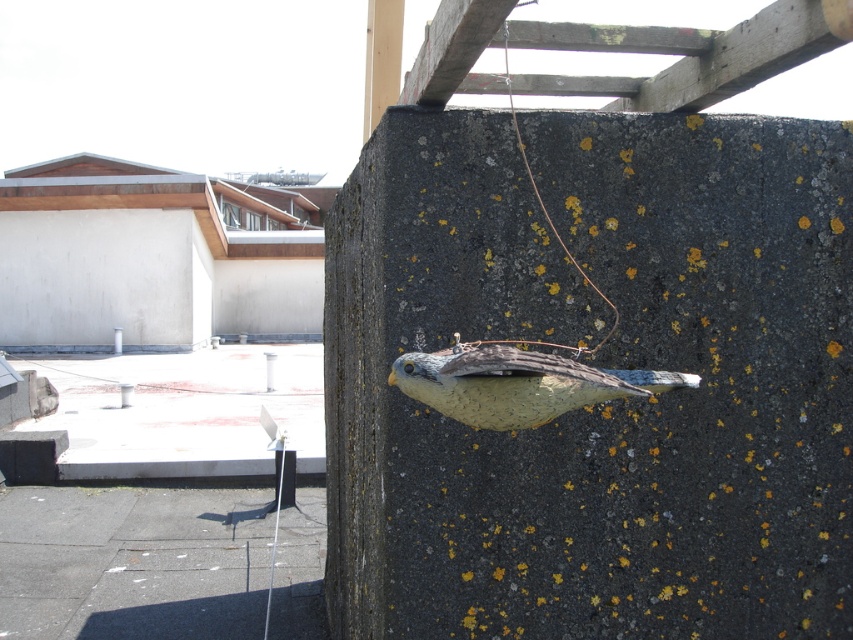
You are an architect inspecting a rooftop. You notice two birds attached to a pillar. One is a speckled concrete bird at center and the other is a speckled clay bird at center. Which one do you think is heavier?

The speckled concrete bird at center is larger in size than the speckled clay bird at center. Since concrete is denser than clay, the speckled concrete bird at center is likely heavier.

You are standing on the rooftop and looking at the scene. There is a point at coordinates [599,365]. Which object in the scene does this point belong to?

The point at coordinates [599,365] belongs to the speckled concrete bird at center.

In the scene shown: You are a delivery robot with a 36 inch wide package. You need to place it between the speckled concrete bird at center and the speckled clay bird at center. Can you fit the package between them?

The distance between the speckled concrete bird at center and the speckled clay bird at center is 36.36 inches. Since the package is 36 inches wide, it can fit between them with a small amount of space remaining.